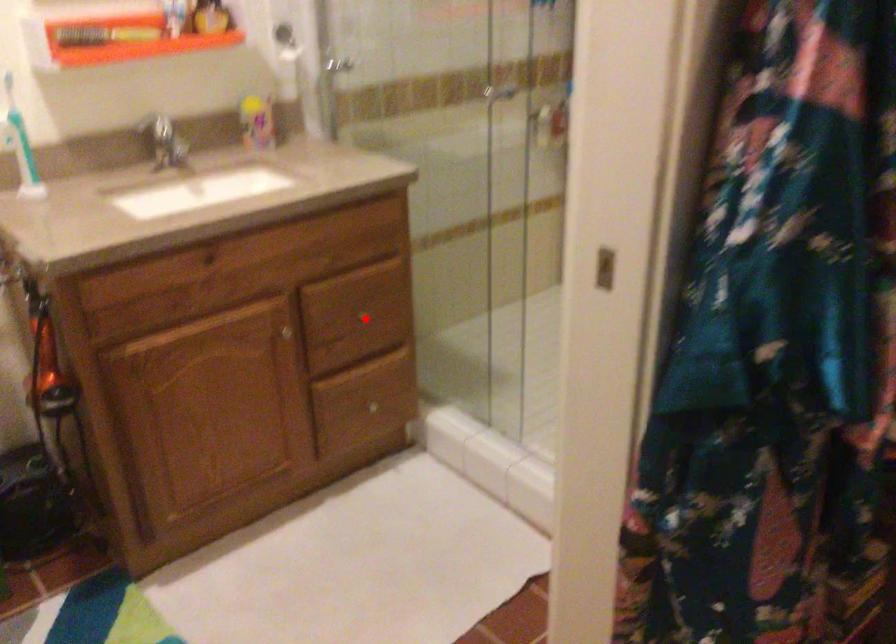
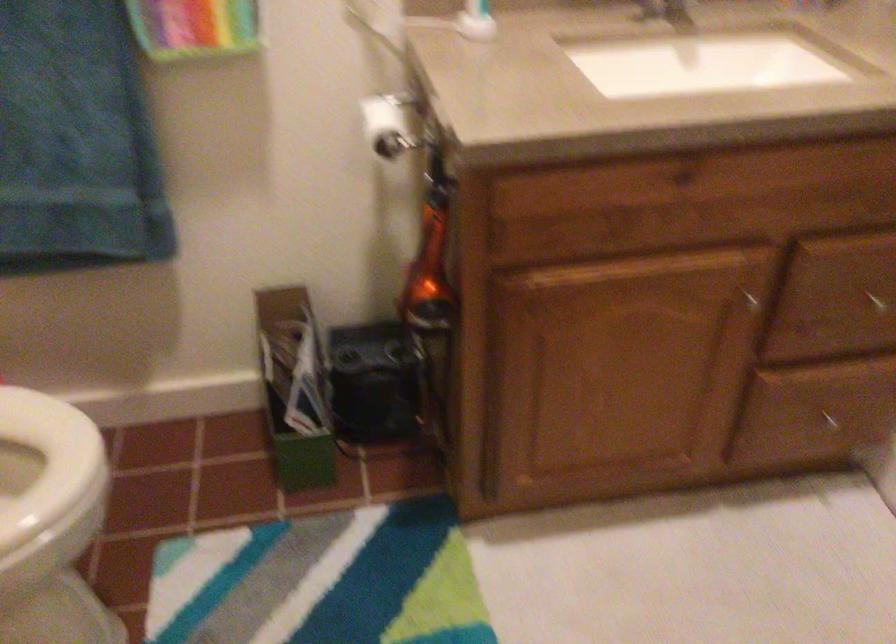
Question: I am providing you with two images of the same scene from different viewpoints. A red point is shown in image1. For the corresponding object point in image2, is it positioned nearer or farther from the camera?

Choices:
 (A) Nearer
 (B) Farther

Answer: (A)